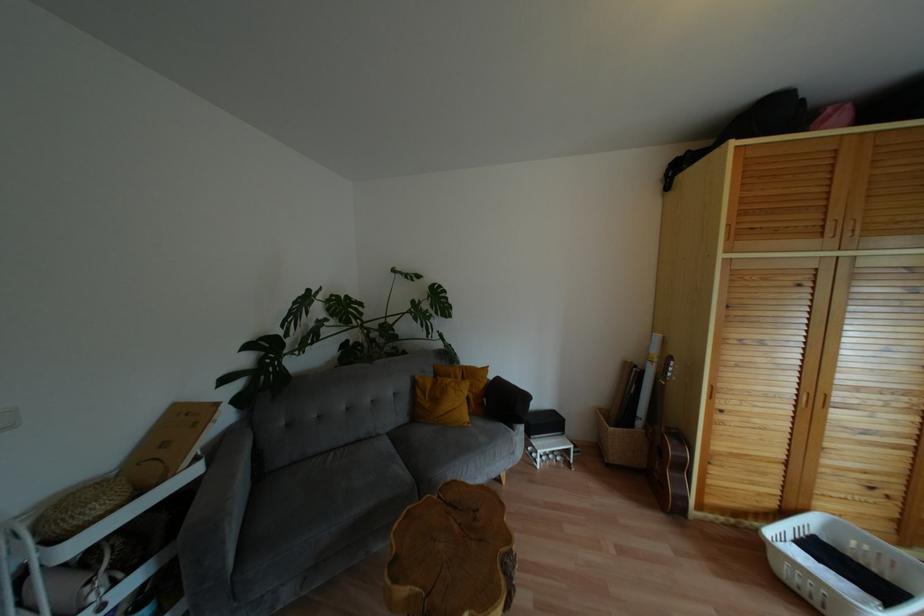
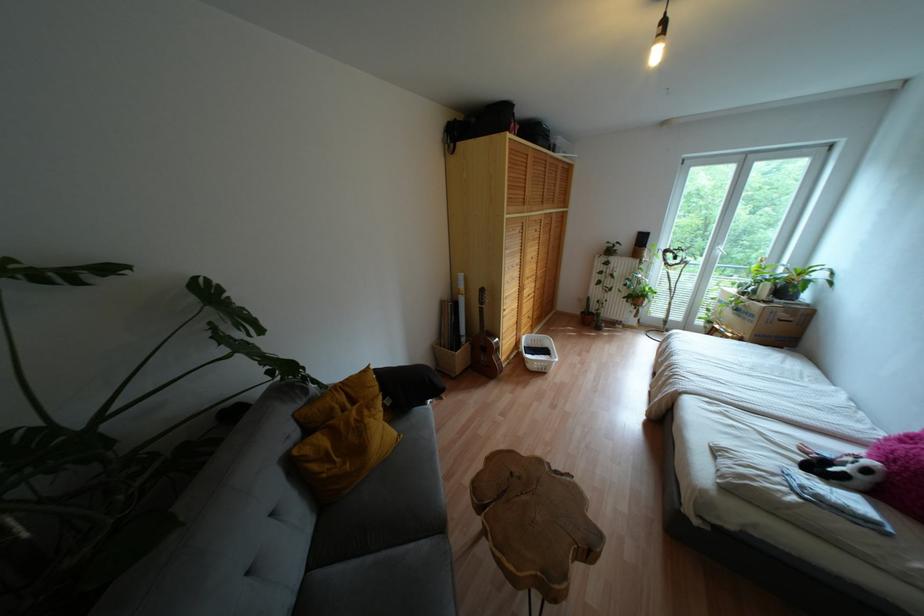
Find the pixel in the second image that matches (397,456) in the first image.

(383, 553)